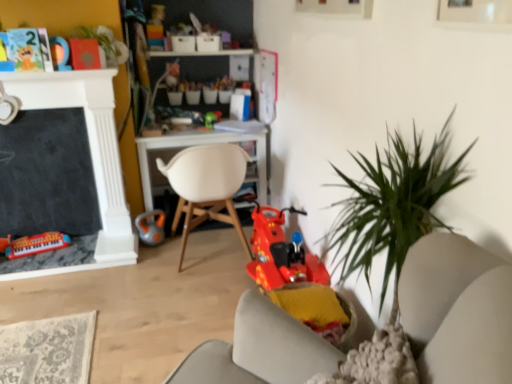
Locate an element on the screen. This screenshot has width=512, height=384. vacant space in between orange rubber kettlebell at center, acting as the 3th toy starting from the right, and white matte chair at center is located at coordinates (165, 255).